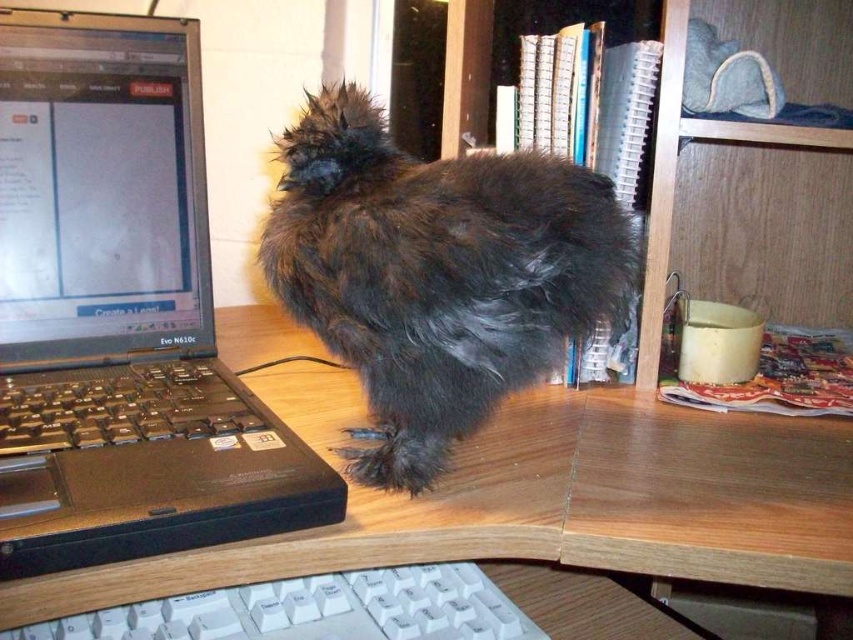
Question: Can you confirm if fluffy dark brown at center is bigger than black plastic keyboard at left?

Choices:
 (A) yes
 (B) no

Answer: (A)

Question: Is fluffy dark brown at center to the left of wooden bookshelf at upper right from the viewer's perspective?

Choices:
 (A) no
 (B) yes

Answer: (B)

Question: Is black plastic laptop at left closer to camera compared to wooden bookshelf at upper right?

Choices:
 (A) yes
 (B) no

Answer: (A)

Question: Based on their relative distances, which object is farther from the black plastic laptop at left?

Choices:
 (A) wooden at center
 (B) wooden bookshelf at upper right
 (C) fluffy dark brown at center

Answer: (B)

Question: Which of the following is the closest to the observer?

Choices:
 (A) (439, 604)
 (B) (376, 413)
 (C) (163, 394)
 (D) (645, 314)

Answer: (A)

Question: Which of the following is the closest to the observer?

Choices:
 (A) (622, 230)
 (B) (219, 385)
 (C) (161, 570)

Answer: (C)